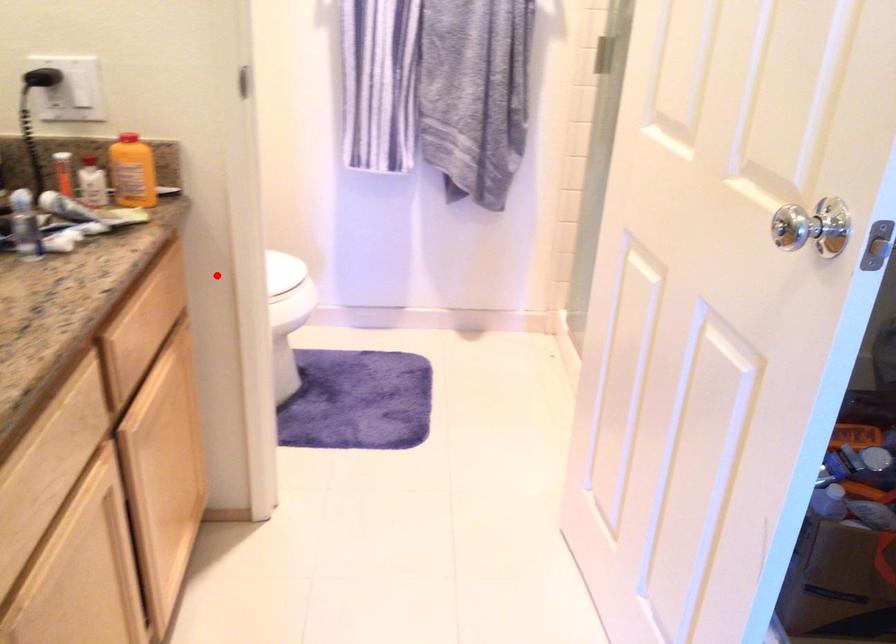
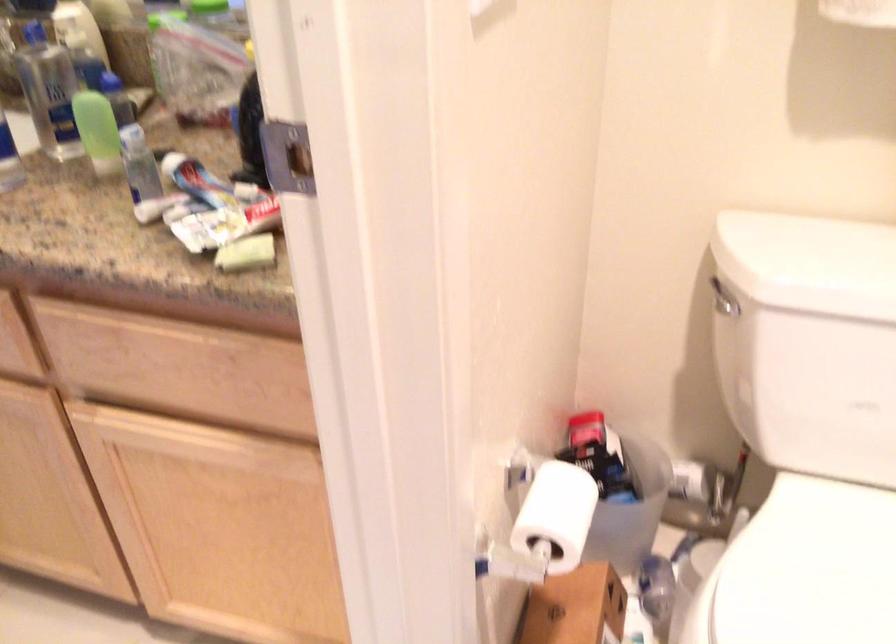
Locate, in the second image, the point that corresponds to the highlighted location in the first image.

(556, 515)